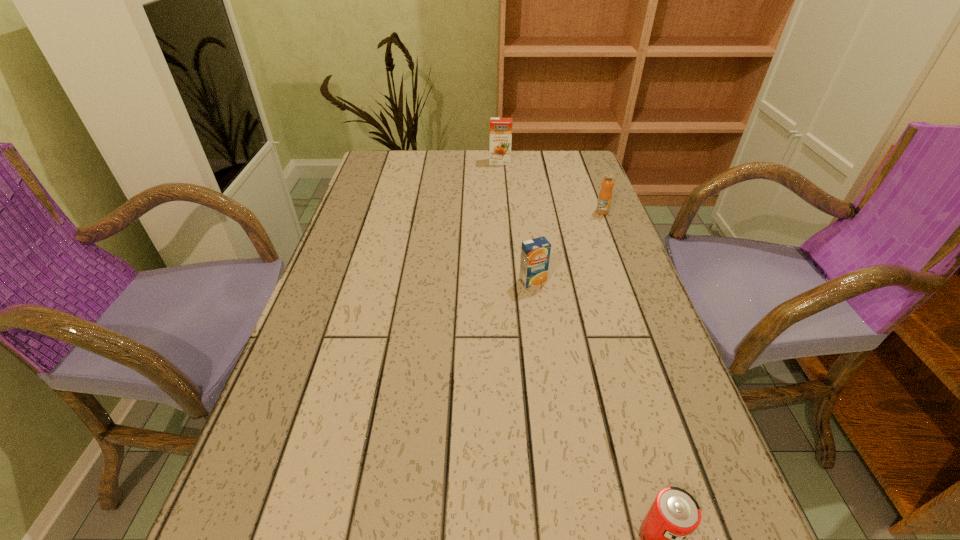
At what (x,y) coordinates should I click in order to perform the action: click on vacant space at the far edge of the desktop. Please return your answer as a coordinate pair (x, y). Looking at the image, I should click on (471, 163).

Identify the location of free space at the left edge of the desktop. This screenshot has width=960, height=540. (317, 375).

You are a GUI agent. You are given a task and a screenshot of the screen. Output one action in this format:
    pyautogui.click(x=<x>, y=<y>)
    Task: Click on the free space at the right edge of the desktop
    This screenshot has height=540, width=960.
    Given the screenshot: What is the action you would take?
    pyautogui.click(x=655, y=497)

Locate an element on the screen. blank space at the far left corner is located at coordinates (383, 164).

Where is `vacant space at the far right corner of the desktop`? The height and width of the screenshot is (540, 960). vacant space at the far right corner of the desktop is located at coordinates (566, 153).

Where is `vacant point located between the tallest orange_juice and the rightmost object`? The width and height of the screenshot is (960, 540). vacant point located between the tallest orange_juice and the rightmost object is located at coordinates 551,187.

The width and height of the screenshot is (960, 540). What are the coordinates of `vacant point located between the nearest orange_juice and the tallest object` in the screenshot? It's located at (516, 221).

Find the location of `free space between the third farthest object and the tallest orange_juice`. free space between the third farthest object and the tallest orange_juice is located at coordinates (516, 221).

Where is `free point between the farthest object and the second farthest object`? The height and width of the screenshot is (540, 960). free point between the farthest object and the second farthest object is located at coordinates (551, 187).

The image size is (960, 540). What are the coordinates of `vacant space that is in between the nearest orange_juice and the tallest object` in the screenshot? It's located at (516, 221).